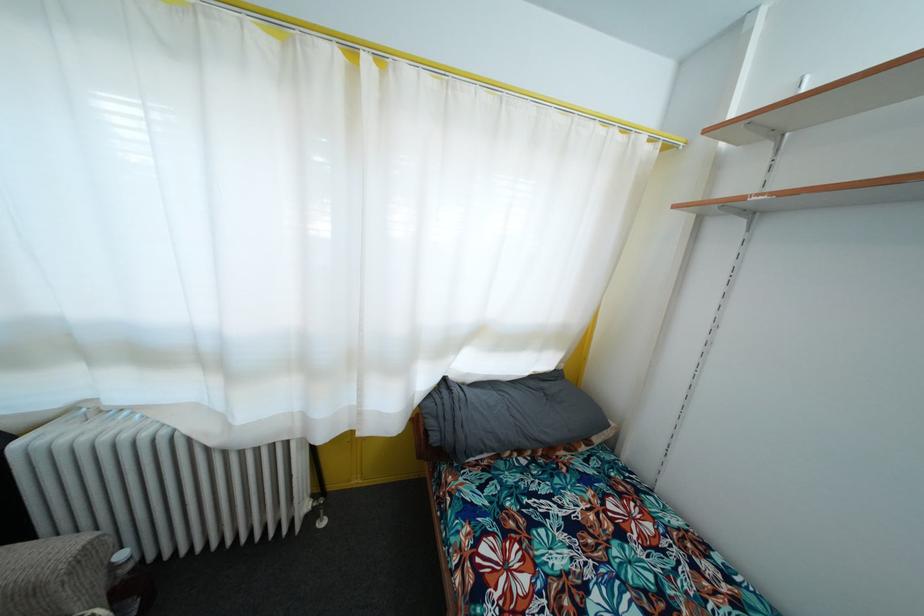
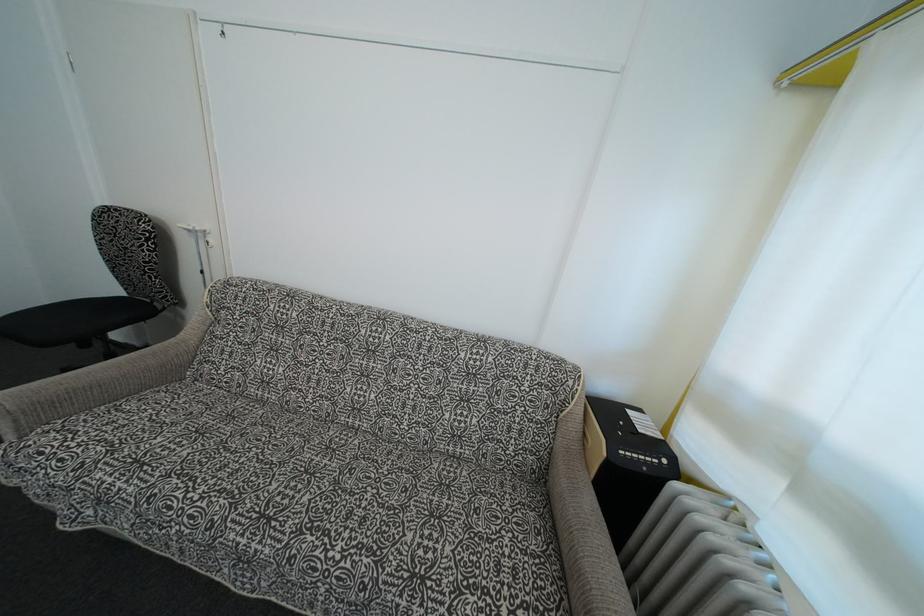
The images are taken continuously from a first-person perspective. In which direction is your viewpoint rotating?

The camera rotated toward left-down.